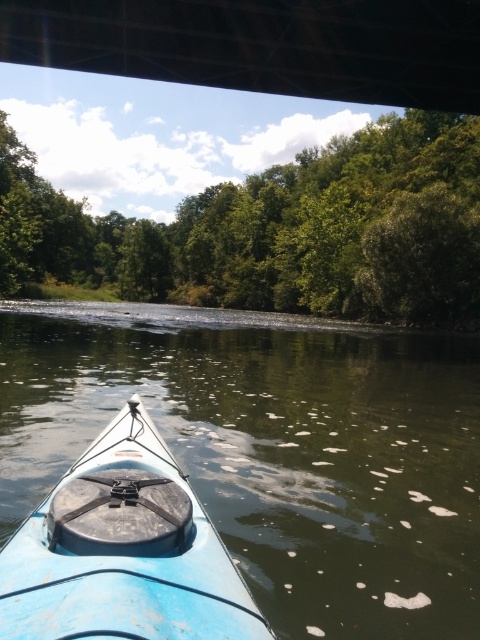
You are in a kayak and need to navigate through a narrow section of the river. You see the green leafy trees at center and the light blue plastic kayak at center. Which object is closer to your current position?

The light blue plastic kayak at center is closer to your current position because it is positioned to the right of the green leafy trees at center, meaning it is nearer to the kayak you are in.

You are in a kayak on a river and see the blue plastic kayak at lower left and the green leafy trees at center. Which object is closer to you from your current position?

The blue plastic kayak at lower left is closer to you because it is positioned below the green leafy trees at center, indicating it is nearer in the visual hierarchy.

You are planning to launch a small boat from the riverbank. Based on the scene, which object is wider, the blue plastic kayak at lower left or the green leafy trees at center?

The blue plastic kayak at lower left has a lesser width compared to green leafy trees at center, so the green leafy trees at center are wider.